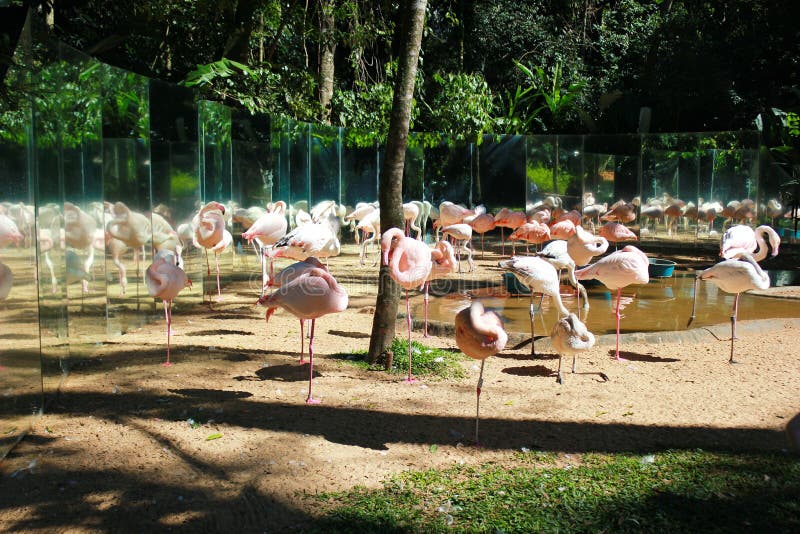
Identify the location of bucket. The width and height of the screenshot is (800, 534). (660, 272).